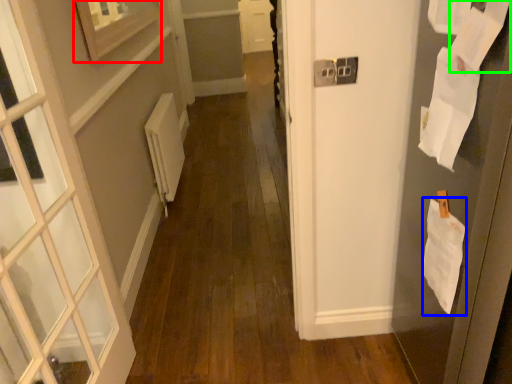
Question: Which object is positioned farthest from picture frame (highlighted by a red box)? Select from paper (highlighted by a blue box) and paper (highlighted by a green box).

Choices:
 (A) paper
 (B) paper

Answer: (A)